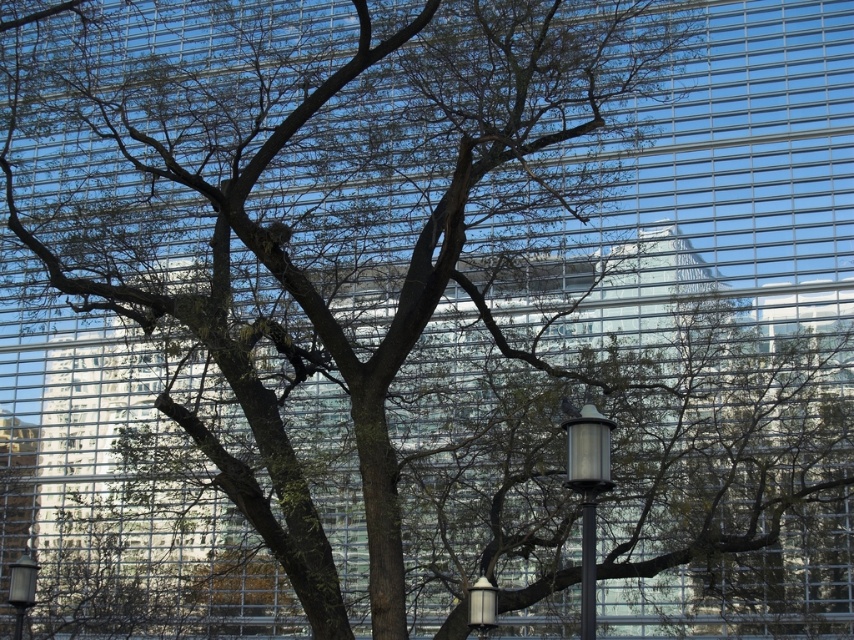
You are standing at the base of the metallic gray lamp post at lower left and want to walk to the metallic silver lamp at lower center. Which direction should you move to reach it?

The metallic gray lamp post at lower left is below the metallic silver lamp at lower center, so you should move upward to reach it.